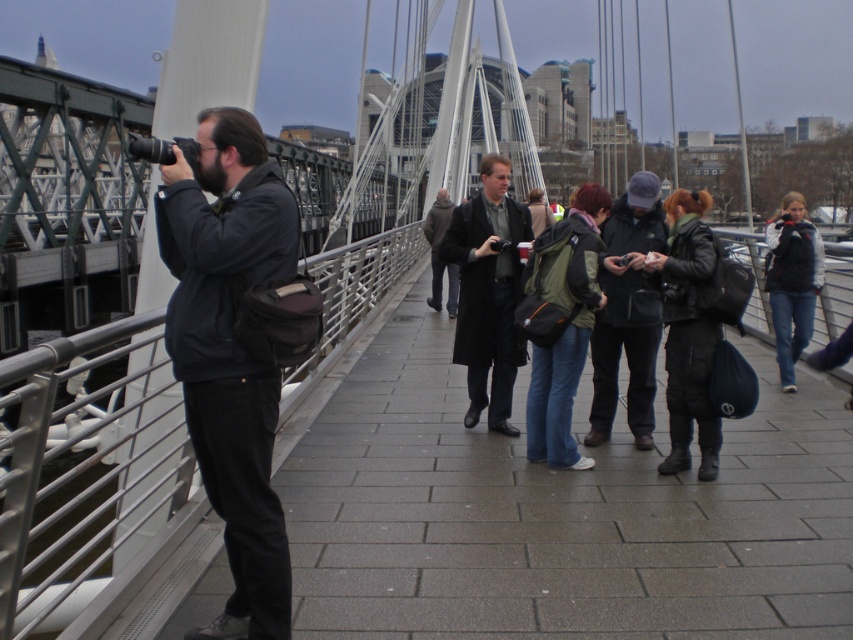
Which is in front, point (173, 312) or point (437, 280)?

Positioned in front is point (173, 312).

Who is more distant from viewer, (253, 140) or (456, 300)?

The point (456, 300) is more distant.

Image resolution: width=853 pixels, height=640 pixels. In order to click on dark gray jacket at left in this screenshot , I will do `click(230, 352)`.

Does dark gray knit cap at center have a larger size compared to denim jacket at right?

No, dark gray knit cap at center is not bigger than denim jacket at right.

Is dark gray knit cap at center positioned before denim jacket at right?

That is True.

Who is more distant from viewer, (619, 262) or (784, 220)?

The point (784, 220) is more distant.

The width and height of the screenshot is (853, 640). I want to click on dark gray knit cap at center, so click(x=628, y=312).

Is the position of green fabric backpack at center more distant than that of dark gray knit cap at center?

No, it is in front of dark gray knit cap at center.

In order to click on green fabric backpack at center in this screenshot , I will do `click(561, 324)`.